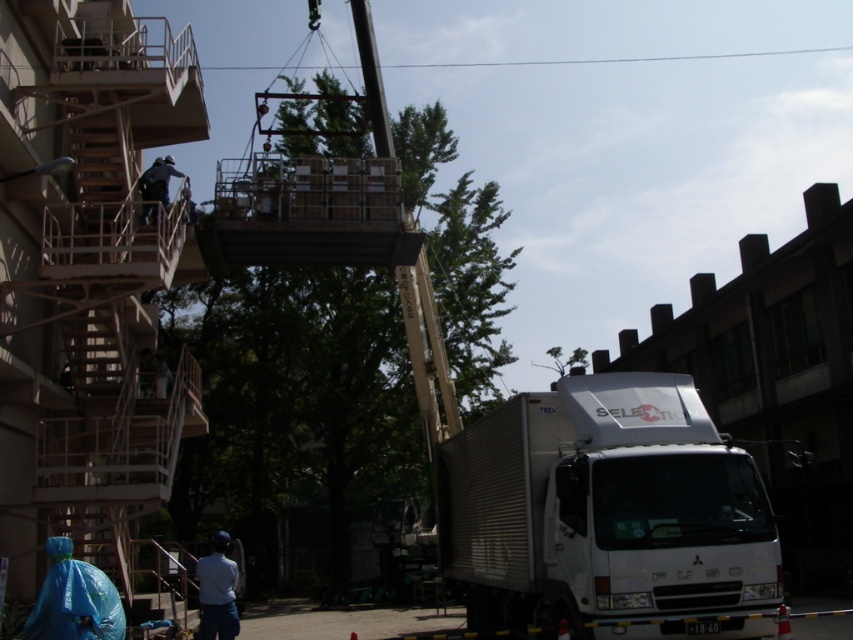
Question: Which point is closer to the camera taking this photo?

Choices:
 (A) (171, 161)
 (B) (502, 616)

Answer: (B)

Question: Among these points, which one is farthest from the camera?

Choices:
 (A) pos(165,163)
 (B) pos(608,547)

Answer: (A)

Question: Is white metallic truck at lower right further to the viewer compared to dark blue uniform at upper left?

Choices:
 (A) yes
 (B) no

Answer: (B)

Question: Does white metallic truck at lower right have a lesser width compared to dark blue uniform at upper left?

Choices:
 (A) no
 (B) yes

Answer: (A)

Question: Does white metallic truck at lower right appear on the left side of dark blue uniform at upper left?

Choices:
 (A) no
 (B) yes

Answer: (A)